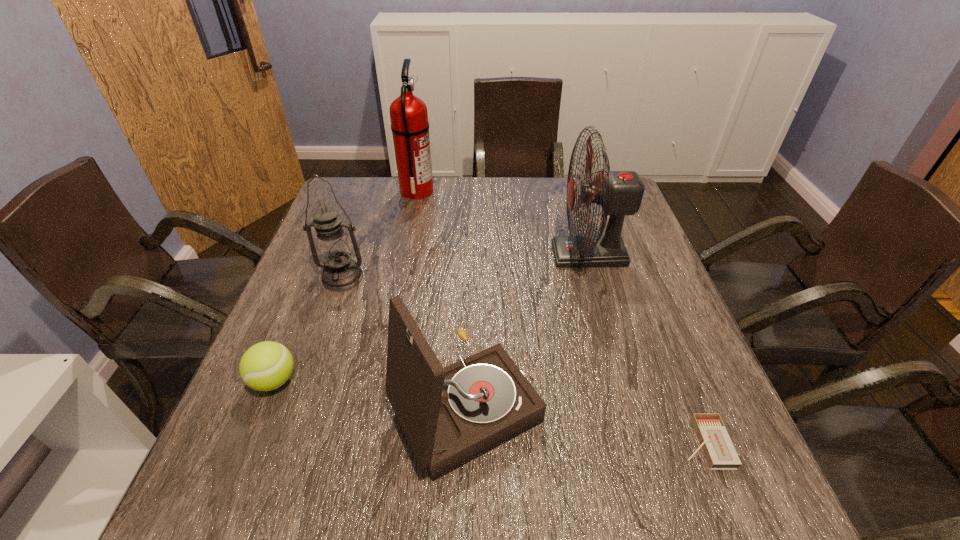
Where is `empty space that is in between the tennis ball and the fan`? The image size is (960, 540). empty space that is in between the tennis ball and the fan is located at coordinates (432, 318).

The height and width of the screenshot is (540, 960). What are the coordinates of `free point between the fan and the shortest object` in the screenshot? It's located at (646, 349).

Where is `empty location between the oil lamp and the fan`? empty location between the oil lamp and the fan is located at coordinates (466, 266).

Where is `vacant region between the oil lamp and the farthest object`? vacant region between the oil lamp and the farthest object is located at coordinates (380, 234).

Locate an element on the screen. vacant area that lies between the fire extinguisher and the matchbox is located at coordinates (561, 317).

Identify the location of the closest object to the phonograph record. The width and height of the screenshot is (960, 540). (619, 193).

Locate an element on the screen. object that is the third closest to the oil lamp is located at coordinates (409, 118).

The height and width of the screenshot is (540, 960). In order to click on vacant region that satisfies the following two spatial constraints: 1. on the back side of the phonograph record; 2. at the nozzle of the farthest object in this screenshot , I will do `click(471, 191)`.

Where is `vacant space that satisfies the following two spatial constraints: 1. on the front-facing side of the fan; 2. on the front side of the tennis ball`? The width and height of the screenshot is (960, 540). vacant space that satisfies the following two spatial constraints: 1. on the front-facing side of the fan; 2. on the front side of the tennis ball is located at coordinates (625, 381).